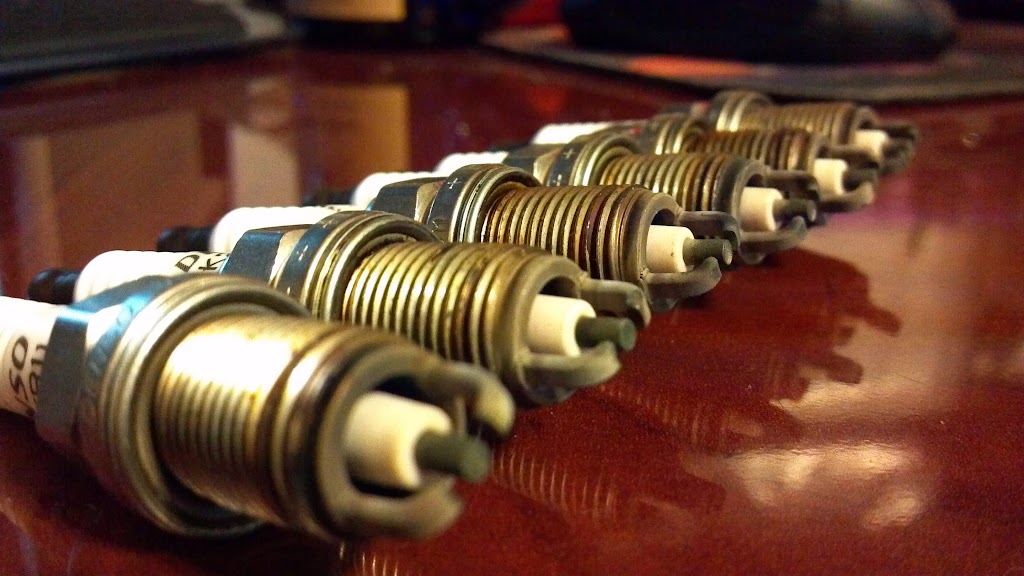
Locate an element on the screen. stickers is located at coordinates (35, 384), (207, 262), (315, 209).